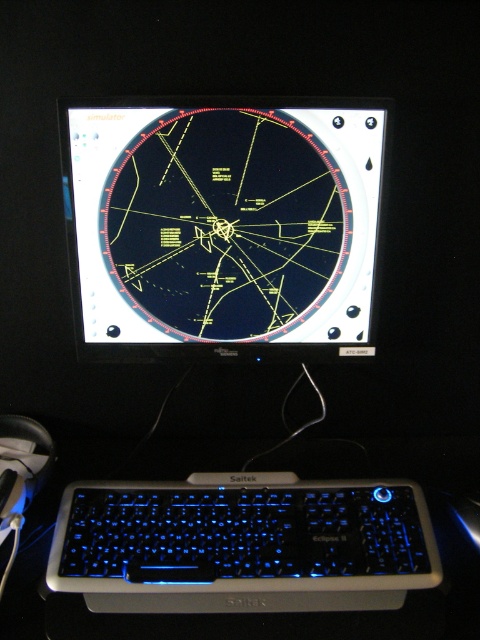
Can you confirm if black plastic monitor at center is taller than blue illuminated plastic keyboard at bottom?

Correct, black plastic monitor at center is much taller as blue illuminated plastic keyboard at bottom.

Is point (333, 516) closer to viewer compared to point (416, 524)?

That is False.

Does point (192, 285) come behind point (372, 588)?

Yes.

The width and height of the screenshot is (480, 640). In order to click on black plastic monitor at center in this screenshot , I will do `click(223, 227)`.

Between point (264, 195) and point (136, 246), which one is positioned behind?

Positioned behind is point (136, 246).

Is black plastic monitor at center to the right of black glossy monitor at center from the viewer's perspective?

Indeed, black plastic monitor at center is positioned on the right side of black glossy monitor at center.

The height and width of the screenshot is (640, 480). I want to click on black plastic monitor at center, so click(223, 227).

Where is `black plastic monitor at center`? The image size is (480, 640). black plastic monitor at center is located at coordinates (223, 227).

Who is shorter, black glossy monitor at center or blue illuminated plastic keyboard at bottom?

Standing shorter between the two is blue illuminated plastic keyboard at bottom.

Image resolution: width=480 pixels, height=640 pixels. What do you see at coordinates (223, 225) in the screenshot?
I see `black glossy monitor at center` at bounding box center [223, 225].

Where is `black glossy monitor at center`? This screenshot has height=640, width=480. black glossy monitor at center is located at coordinates (223, 225).

The height and width of the screenshot is (640, 480). In order to click on black glossy monitor at center in this screenshot , I will do `click(223, 225)`.